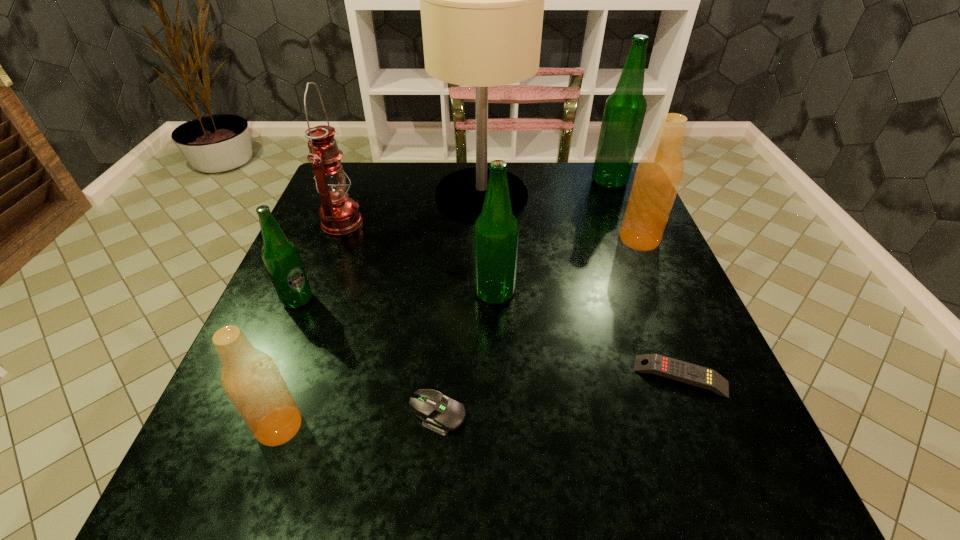
Where is `vacant space located 0.190m on the front of the bigger tan beer bottle`? This screenshot has width=960, height=540. vacant space located 0.190m on the front of the bigger tan beer bottle is located at coordinates (670, 313).

Find the location of a particular element. The width and height of the screenshot is (960, 540). vacant region located on the label of the second green beer bottle from left to right is located at coordinates tap(359, 293).

Locate an element on the screen. This screenshot has width=960, height=540. vacant space located on the label of the second green beer bottle from left to right is located at coordinates (335, 293).

What are the coordinates of `blank space located on the label of the second green beer bottle from left to right` in the screenshot? It's located at (311, 293).

I want to click on vacant space located on the label of the smallest green beer bottle, so click(x=381, y=300).

Find the location of `free space located on the right of the nearer tan beer bottle`. free space located on the right of the nearer tan beer bottle is located at coordinates (446, 427).

Image resolution: width=960 pixels, height=540 pixels. I want to click on free location located on the left of the computer mouse, so click(x=366, y=414).

This screenshot has height=540, width=960. I want to click on vacant point located 0.050m on the back of the shortest object, so click(664, 334).

Where is `table lamp situated at the far edge`? table lamp situated at the far edge is located at coordinates (482, 0).

Identify the location of beer bottle at the far edge. The image size is (960, 540). pos(624,112).